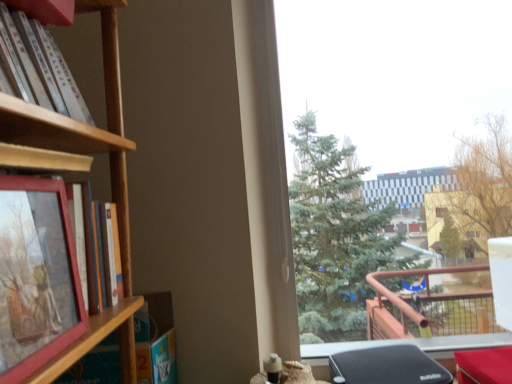
This screenshot has width=512, height=384. Describe the element at coordinates (103, 247) in the screenshot. I see `matte wooden book at left, which is the second book from top to bottom` at that location.

Image resolution: width=512 pixels, height=384 pixels. What do you see at coordinates (39, 66) in the screenshot?
I see `white matte book at upper left, which ranks as the second book in bottom-to-top order` at bounding box center [39, 66].

From the picture: Measure the distance between point (16,295) and camera.

The distance of point (16,295) from camera is 19.96 inches.

Locate an element on the screen. The image size is (512, 384). matte wooden book at left, marked as the first book in a bottom-to-top arrangement is located at coordinates (103, 247).

Is white matte book at upper left, which ranks as the second book in bottom-to-top order, to the left of matte wooden picture frame at left from the viewer's perspective?

Indeed, white matte book at upper left, which ranks as the second book in bottom-to-top order, is positioned on the left side of matte wooden picture frame at left.

Is the position of white matte book at upper left, which ranks as the second book in bottom-to-top order, more distant than that of matte wooden picture frame at left?

Yes, it is behind matte wooden picture frame at left.

From the image's perspective, relative to matte wooden picture frame at left, is white matte book at upper left, which ranks as the second book in bottom-to-top order, above or below?

From the image's perspective, white matte book at upper left, which ranks as the second book in bottom-to-top order, appears above matte wooden picture frame at left.

Which object is more forward, wooden shelf at left or matte wooden book at left, which is the second book from top to bottom?

matte wooden book at left, which is the second book from top to bottom, is more forward.

Can you confirm if wooden shelf at left is positioned to the right of matte wooden book at left, which is the second book from top to bottom?

No, wooden shelf at left is not to the right of matte wooden book at left, which is the second book from top to bottom.

In the scene shown: Is wooden shelf at left positioned with its back to matte wooden book at left, which is the second book from top to bottom?

That's not correct — wooden shelf at left is not looking away from matte wooden book at left, which is the second book from top to bottom.

From the picture: From a real-world perspective, relative to matte wooden book at left, marked as the first book in a bottom-to-top arrangement, is wooden shelf at left vertically above or below?

wooden shelf at left is situated lower than matte wooden book at left, marked as the first book in a bottom-to-top arrangement, in the real world.

Is wooden shelf at left far away from white matte book at upper left, which ranks as the second book in bottom-to-top order?

Actually, wooden shelf at left and white matte book at upper left, which ranks as the second book in bottom-to-top order, are a little close together.

Can you confirm if wooden shelf at left is taller than white matte book at upper left, arranged as the 1th book when viewed from the top?

Yes, wooden shelf at left is taller than white matte book at upper left, arranged as the 1th book when viewed from the top.

From the image's perspective, is wooden shelf at left located above white matte book at upper left, which ranks as the second book in bottom-to-top order?

No, from the image's perspective, wooden shelf at left is not above white matte book at upper left, which ranks as the second book in bottom-to-top order.

Can you tell me how much wooden shelf at left and white matte book at upper left, arranged as the 1th book when viewed from the top, differ in facing direction?

wooden shelf at left and white matte book at upper left, arranged as the 1th book when viewed from the top, are facing 2.84 degrees away from each other.

Are wooden shelf at left and transparent glass window at upper right beside each other?

wooden shelf at left and transparent glass window at upper right are clearly separated.

Is wooden shelf at left positioned beyond the bounds of transparent glass window at upper right?

Absolutely, wooden shelf at left is external to transparent glass window at upper right.

Could you tell me if wooden shelf at left is facing transparent glass window at upper right?

Yes, wooden shelf at left is turned towards transparent glass window at upper right.

How distant is matte wooden book at left, marked as the first book in a bottom-to-top arrangement, from white matte book at upper left, which ranks as the second book in bottom-to-top order?

matte wooden book at left, marked as the first book in a bottom-to-top arrangement, is 8.77 inches from white matte book at upper left, which ranks as the second book in bottom-to-top order.

From a real-world perspective, between matte wooden book at left, marked as the first book in a bottom-to-top arrangement, and white matte book at upper left, which ranks as the second book in bottom-to-top order, who is vertically higher?

white matte book at upper left, which ranks as the second book in bottom-to-top order.

Which object is further away from the camera, matte wooden book at left, marked as the first book in a bottom-to-top arrangement, or white matte book at upper left, arranged as the 1th book when viewed from the top?

matte wooden book at left, marked as the first book in a bottom-to-top arrangement, is further from the camera.

Between matte wooden book at left, which is the second book from top to bottom, and white matte book at upper left, arranged as the 1th book when viewed from the top, which one has larger size?

white matte book at upper left, arranged as the 1th book when viewed from the top, is bigger.

From the image's perspective, is wooden shelf at left above or below matte wooden picture frame at left?

From the image's perspective, wooden shelf at left appears below matte wooden picture frame at left.

From the picture: How many degrees apart are the facing directions of wooden shelf at left and matte wooden picture frame at left?

There is a 4.53-degree angle between the facing directions of wooden shelf at left and matte wooden picture frame at left.

Relative to matte wooden picture frame at left, is wooden shelf at left in front or behind?

wooden shelf at left is positioned farther from the viewer than matte wooden picture frame at left.

At what (x,y) coordinates should I click in order to perform the action: click on window above the matte wooden picture frame at left (from a real-world perspective). Please return your answer as a coordinate pair (x, y). The width and height of the screenshot is (512, 384). Looking at the image, I should click on (396, 72).

Consider the image. Is transparent glass window at upper right facing towards matte wooden picture frame at left?

No, transparent glass window at upper right does not turn towards matte wooden picture frame at left.

From the image's perspective, is transparent glass window at upper right over matte wooden picture frame at left?

Indeed, from the image's perspective, transparent glass window at upper right is shown above matte wooden picture frame at left.

Is transparent glass window at upper right positioned far away from matte wooden picture frame at left?

Yes, transparent glass window at upper right and matte wooden picture frame at left are located far from each other.

This screenshot has height=384, width=512. Identify the location of picture frame lying on the right of white matte book at upper left, arranged as the 1th book when viewed from the top. (36, 276).

Starting from the wooden shelf at left, which book is the 1st one in front? Please provide its 2D coordinates.

[(103, 247)]

Estimate the real-world distances between objects in this image. Which object is closer to white matte book at upper left, arranged as the 1th book when viewed from the top, matte wooden picture frame at left or transparent glass window at upper right?

matte wooden picture frame at left lies closer to white matte book at upper left, arranged as the 1th book when viewed from the top, than the other object.

Looking at the image, which one is located closer to transparent glass window at upper right, white matte book at upper left, arranged as the 1th book when viewed from the top, or matte wooden picture frame at left?

Among the two, white matte book at upper left, arranged as the 1th book when viewed from the top, is located nearer to transparent glass window at upper right.

When comparing their distances from matte wooden book at left, which is the second book from top to bottom, does wooden shelf at left or white matte book at upper left, which ranks as the second book in bottom-to-top order, seem closer?

wooden shelf at left is closer to matte wooden book at left, which is the second book from top to bottom.

Looking at the image, which one is located further to white matte book at upper left, which ranks as the second book in bottom-to-top order, matte wooden picture frame at left or wooden shelf at left?

wooden shelf at left is positioned further to the anchor white matte book at upper left, which ranks as the second book in bottom-to-top order.

Looking at the image, which one is located further to matte wooden picture frame at left, white matte book at upper left, which ranks as the second book in bottom-to-top order, or wooden shelf at left?

The object further to matte wooden picture frame at left is white matte book at upper left, which ranks as the second book in bottom-to-top order.

Based on their spatial positions, is wooden shelf at left or white matte book at upper left, which ranks as the second book in bottom-to-top order, closer to transparent glass window at upper right?

white matte book at upper left, which ranks as the second book in bottom-to-top order, lies closer to transparent glass window at upper right than the other object.

Considering their positions, is matte wooden book at left, marked as the first book in a bottom-to-top arrangement, positioned further to transparent glass window at upper right than white matte book at upper left, arranged as the 1th book when viewed from the top?

white matte book at upper left, arranged as the 1th book when viewed from the top, is positioned further to the anchor transparent glass window at upper right.

Based on their spatial positions, is matte wooden book at left, marked as the first book in a bottom-to-top arrangement, or transparent glass window at upper right further from matte wooden picture frame at left?

transparent glass window at upper right lies further to matte wooden picture frame at left than the other object.

Locate an element on the screen. book situated between white matte book at upper left, which ranks as the second book in bottom-to-top order, and transparent glass window at upper right from left to right is located at coordinates (103, 247).

Image resolution: width=512 pixels, height=384 pixels. I want to click on picture frame between white matte book at upper left, arranged as the 1th book when viewed from the top, and wooden shelf at left vertically, so click(x=36, y=276).

The height and width of the screenshot is (384, 512). What are the coordinates of `book between white matte book at upper left, which ranks as the second book in bottom-to-top order, and wooden shelf at left, in the vertical direction` in the screenshot? It's located at (103, 247).

Where is `shelf between white matte book at upper left, arranged as the 1th book when viewed from the top, and transparent glass window at upper right from left to right`? The width and height of the screenshot is (512, 384). shelf between white matte book at upper left, arranged as the 1th book when viewed from the top, and transparent glass window at upper right from left to right is located at coordinates (87, 340).